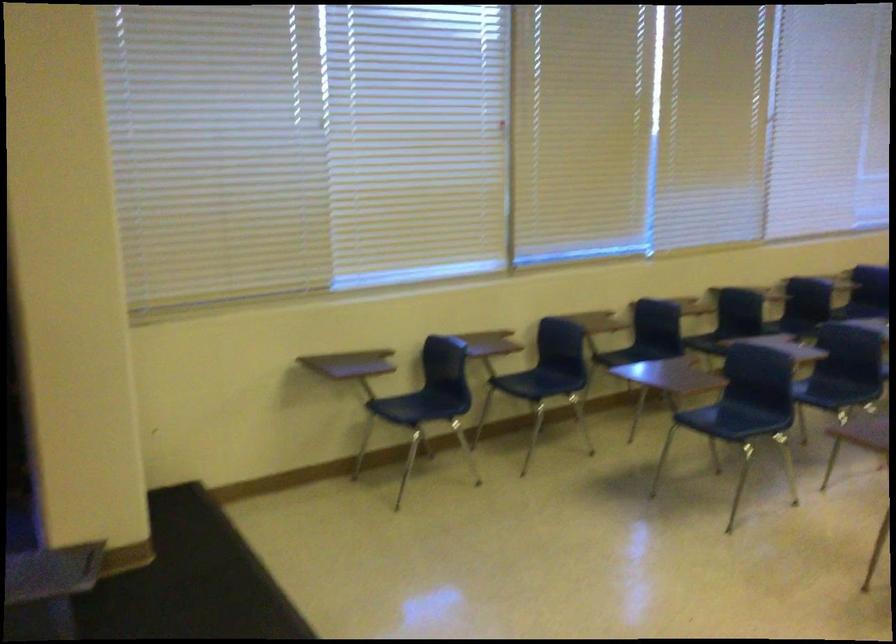
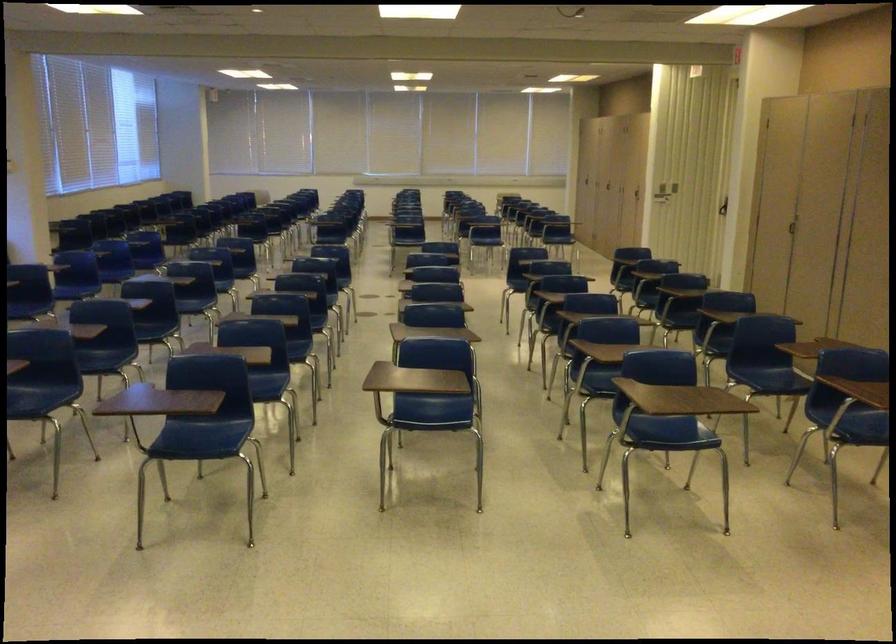
Question: The camera is either moving clockwise (left) or counter-clockwise (right) around the object. The first image is from the beginning of the video and the second image is from the end. Is the camera moving left or right when shooting the video?

Choices:
 (A) Left
 (B) Right

Answer: (A)